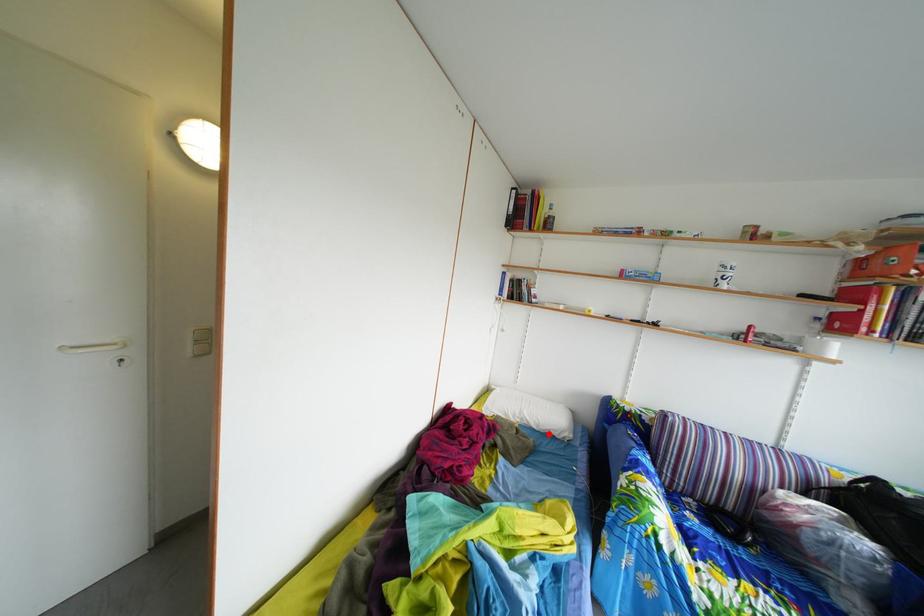
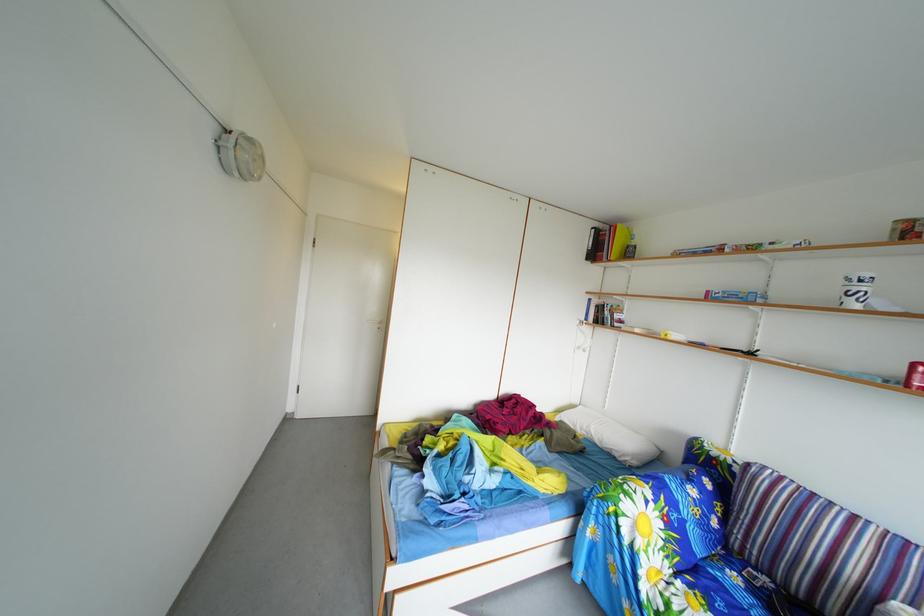
Where in the second image is the point corresponding to the highlighted location from the first image?

(612, 451)